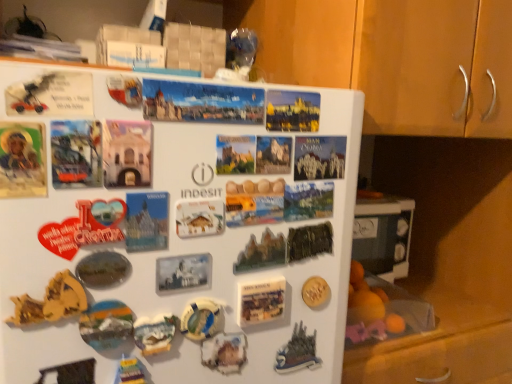
Question: Is wooden cabinet at upper right taller than matte plastic magnet at lower center, the 4th art positioned from the left?

Choices:
 (A) yes
 (B) no

Answer: (A)

Question: Is wooden cabinet at upper right positioned beyond the bounds of matte plastic magnet at lower center, the 4th art positioned from the left?

Choices:
 (A) no
 (B) yes

Answer: (B)

Question: From a real-world perspective, is wooden cabinet at upper right on matte plastic magnet at lower center, the 4th art positioned from the left?

Choices:
 (A) yes
 (B) no

Answer: (A)

Question: Can you confirm if wooden cabinet at upper right is wider than matte plastic magnet at lower center, the 4th art positioned from the left?

Choices:
 (A) no
 (B) yes

Answer: (B)

Question: Is wooden cabinet at upper right closer to the viewer compared to matte plastic magnet at lower center, the 4th art positioned from the left?

Choices:
 (A) no
 (B) yes

Answer: (A)

Question: Is wooden cabinet at upper right not near matte plastic magnet at lower center, the 4th art positioned from the left?

Choices:
 (A) no
 (B) yes

Answer: (A)

Question: Can you confirm if wooden cabinet at upper right is shorter than gold textured coin at center, which is counted as the first art, starting from the right?

Choices:
 (A) no
 (B) yes

Answer: (A)

Question: From the image's perspective, is wooden cabinet at upper right below gold textured coin at center, the 10th art in the left-to-right sequence?

Choices:
 (A) yes
 (B) no

Answer: (B)

Question: Considering the relative positions of wooden cabinet at upper right and gold textured coin at center, the 10th art in the left-to-right sequence, in the image provided, is wooden cabinet at upper right to the left of gold textured coin at center, the 10th art in the left-to-right sequence, from the viewer's perspective?

Choices:
 (A) no
 (B) yes

Answer: (A)

Question: Is the depth of wooden cabinet at upper right less than that of gold textured coin at center, the 10th art in the left-to-right sequence?

Choices:
 (A) no
 (B) yes

Answer: (B)

Question: Is wooden cabinet at upper right looking in the opposite direction of gold textured coin at center, the 10th art in the left-to-right sequence?

Choices:
 (A) no
 (B) yes

Answer: (A)

Question: Is gold textured coin at center, the 10th art in the left-to-right sequence, inside wooden cabinet at upper right?

Choices:
 (A) no
 (B) yes

Answer: (A)

Question: Considering the relative sizes of metallic silver magnet at lower left, which is the 3th art from left to right, and matte plastic postcard at upper center, which appears as the 1th postcard when viewed from the top, in the image provided, is metallic silver magnet at lower left, which is the 3th art from left to right, shorter than matte plastic postcard at upper center, which appears as the 1th postcard when viewed from the top,?

Choices:
 (A) no
 (B) yes

Answer: (A)